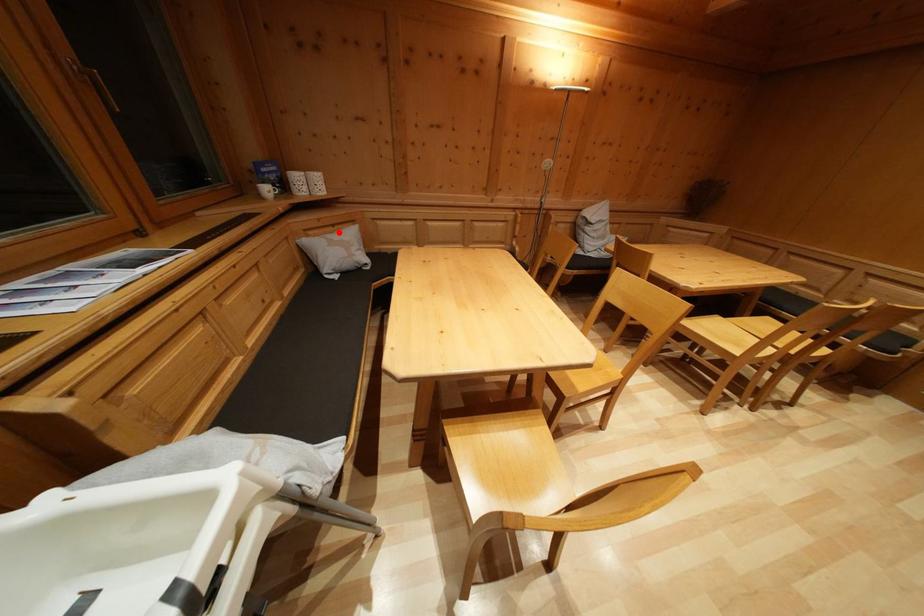
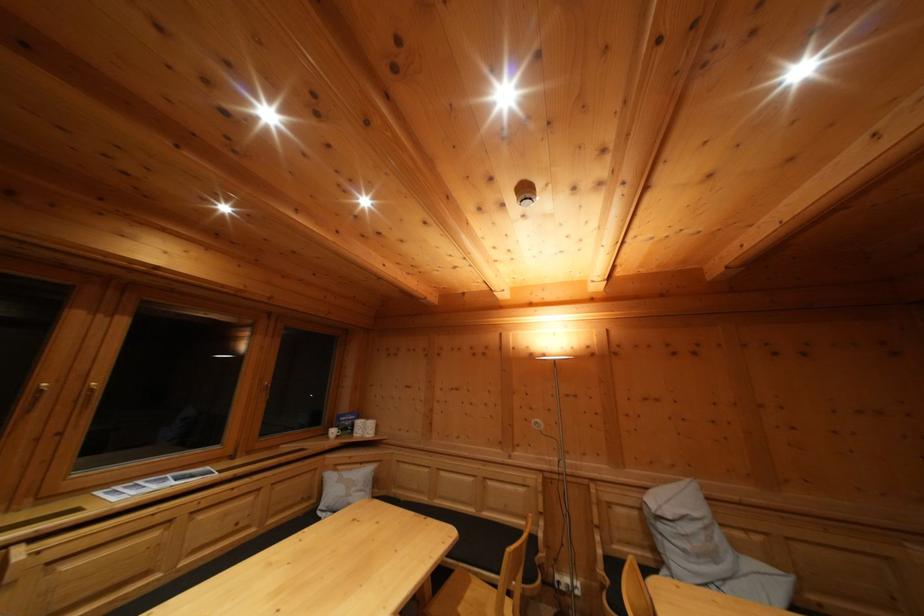
Question: I am providing you with two images of the same scene from different viewpoints. Image1 has a red point marked. In image2, the corresponding 3D location appears at what relative position? Reply with the corresponding letter.

Choices:
 (A) Closer
 (B) Farther

Answer: (B)